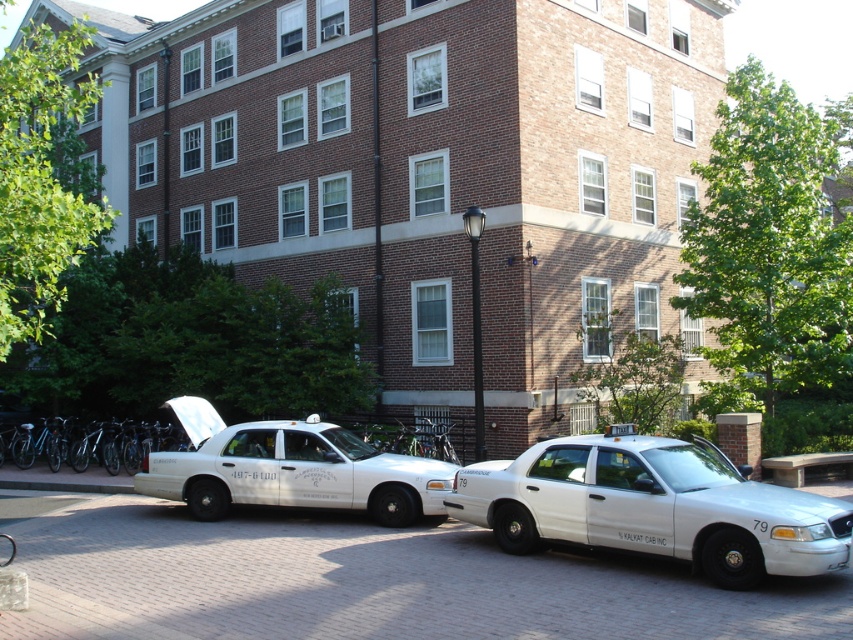
Is white brick pavement at center thinner than white glossy sedan at center?

In fact, white brick pavement at center might be wider than white glossy sedan at center.

From the picture: Does white brick pavement at center appear on the left side of white glossy sedan at center?

Indeed, white brick pavement at center is positioned on the left side of white glossy sedan at center.

The width and height of the screenshot is (853, 640). In order to click on white brick pavement at center in this screenshot , I will do `click(369, 582)`.

Is white brick pavement at center smaller than white glossy taxi at center?

No.

Locate an element on the screen. This screenshot has width=853, height=640. white brick pavement at center is located at coordinates (369, 582).

Who is more distant from viewer, (85,624) or (415,461)?

The point (415,461) is behind.

The height and width of the screenshot is (640, 853). Find the location of `white brick pavement at center`. white brick pavement at center is located at coordinates (369, 582).

Can you confirm if white glossy sedan at center is positioned below white glossy taxi at center?

No, white glossy sedan at center is not below white glossy taxi at center.

Find the location of `white glossy sedan at center`. white glossy sedan at center is located at coordinates (654, 506).

Which is behind, point (531, 470) or point (252, 493)?

The point (252, 493) is behind.

You are a GUI agent. You are given a task and a screenshot of the screen. Output one action in this format:
    pyautogui.click(x=<x>, y=<y>)
    Task: Click on the white glossy sedan at center
    Image resolution: width=853 pixels, height=640 pixels.
    Given the screenshot: What is the action you would take?
    pyautogui.click(x=654, y=506)